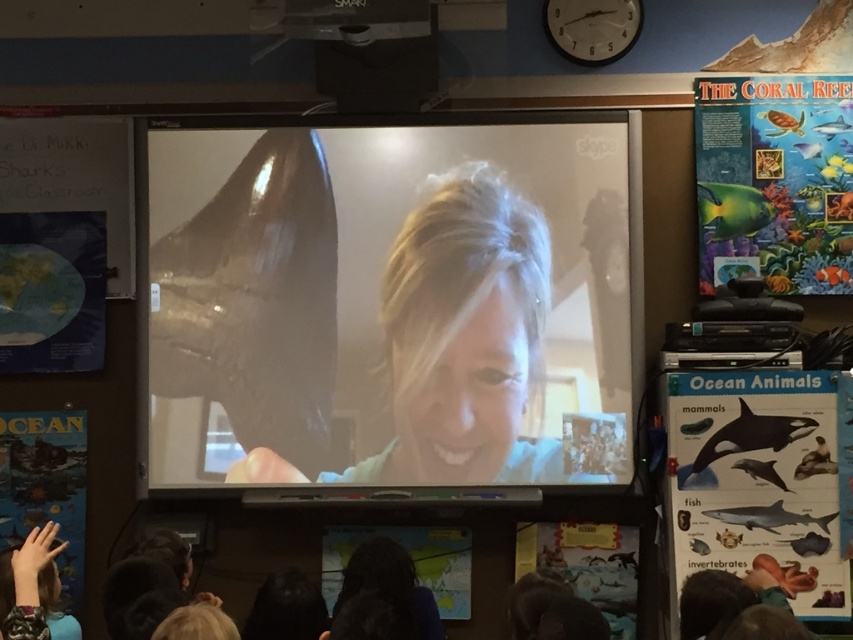
Question: Which point is farther from the camera taking this photo?

Choices:
 (A) (747, 548)
 (B) (581, 531)
 (C) (782, 209)

Answer: (C)

Question: Does matte paper ocean animals chart at right have a smaller size compared to blue matte globe at left?

Choices:
 (A) yes
 (B) no

Answer: (B)

Question: Which object is closer to the camera taking this photo?

Choices:
 (A) ocean-themed poster at lower left
 (B) blue matte globe at left

Answer: (A)

Question: Is ocean-themed poster at lower left above matte paper poster at lower center?

Choices:
 (A) yes
 (B) no

Answer: (A)

Question: Which point is farther to the camera?

Choices:
 (A) (45, 300)
 (B) (61, 586)

Answer: (A)

Question: Does vibrant paper coral reef poster at upper right lie in front of blue matte globe at left?

Choices:
 (A) no
 (B) yes

Answer: (A)